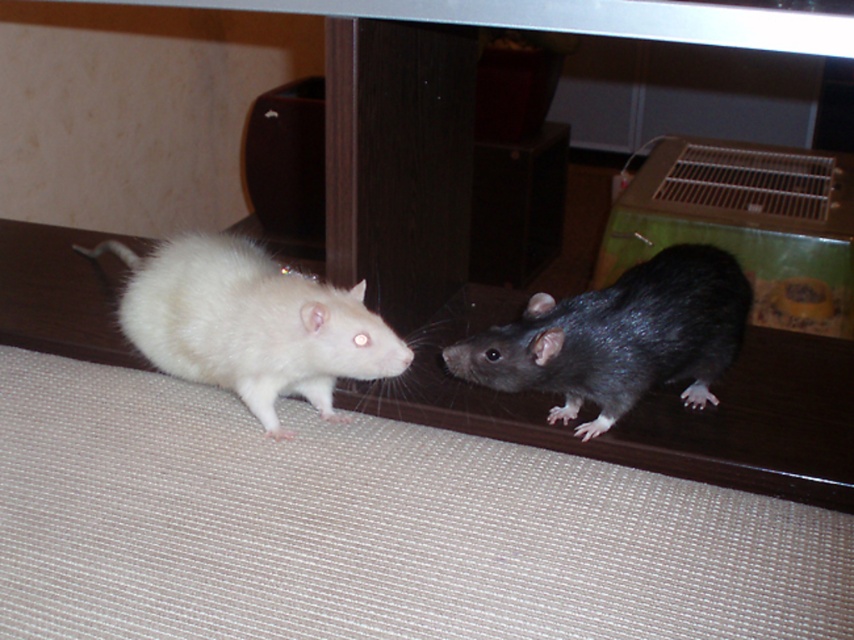
You are a pet owner who wants to place both the white furry hamster at left and the shiny black rat at right into a cage that can only accommodate one of them. Based on their sizes, which one would you choose to fit into the cage?

The shiny black rat at right would fit into the cage since the white furry hamster at left is wider.

You are a pet owner who wants to separate the two animals in the image. The white furry hamster at left and the shiny black rat at right are currently on the same wooden surface. Which animal is physically above the other, requiring you to move which one first to avoid disturbing the other?

The white furry hamster at left is positioned over the shiny black rat at right, so you should move the white furry hamster at left first to avoid disturbing the shiny black rat at right.

Consider the image. You are a pet owner who wants to place a small toy between the white furry hamster at left and the shiny black rat at right. Given that the toy requires 12 inches of space to be placed safely, can you fit it between them?

The distance between the white furry hamster at left and the shiny black rat at right is 12.18 inches, which is just enough to fit the toy requiring 12 inches of space safely.